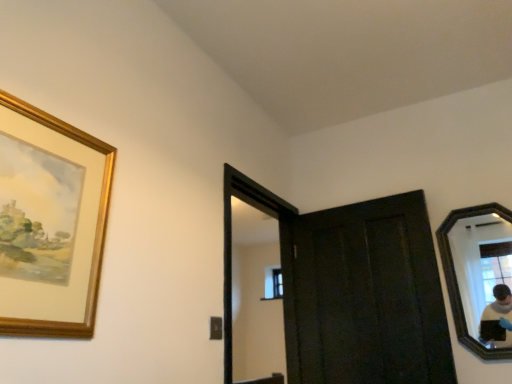
In order to face gold-framed painting at upper left, should I rotate leftwards or rightwards?

Turn left by 25.810 degrees to look at gold-framed painting at upper left.

You are a GUI agent. You are given a task and a screenshot of the screen. Output one action in this format:
    pyautogui.click(x=<x>, y=<y>)
    Task: Click on the dark wood door at center
    
    Given the screenshot: What is the action you would take?
    pyautogui.click(x=364, y=295)

Is clear glass window at center wider than dark wood door at center?

No.

Considering the relative positions of clear glass window at center and dark wood door at center in the image provided, is clear glass window at center to the right of dark wood door at center from the viewer's perspective?

No, clear glass window at center is not to the right of dark wood door at center.

Is clear glass window at center not inside dark wood door at center?

Yes, clear glass window at center is located beyond the bounds of dark wood door at center.

Is clear glass window at center bigger or smaller than dark wood door at center?

Considering their sizes, clear glass window at center takes up less space than dark wood door at center.

Would you consider gold-framed painting at upper left to be distant from dark wood door at center?

Yes, gold-framed painting at upper left is far from dark wood door at center.

Is gold-framed painting at upper left oriented away from dark wood door at center?

No, gold-framed painting at upper left is not facing away from dark wood door at center.

Can you confirm if gold-framed painting at upper left is positioned to the left of dark wood door at center?

Yes.

Consider the image. From a real-world perspective, is gold-framed painting at upper left physically below dark wood door at center?

No, from a real-world perspective, gold-framed painting at upper left is not below dark wood door at center.

Is black wooden mirror at right turned away from clear glass window at center?

No.

Can you confirm if black wooden mirror at right is positioned to the left of clear glass window at center?

In fact, black wooden mirror at right is to the right of clear glass window at center.

Is black wooden mirror at right completely or partially outside of clear glass window at center?

Yes, black wooden mirror at right is located beyond the bounds of clear glass window at center.

Is point (300, 225) positioned after point (486, 293)?

Yes, it is.

Are dark wood door at center and black wooden mirror at right located far from each other?

No, dark wood door at center is not far away from black wooden mirror at right.

Where is `door below the black wooden mirror at right (from the image's perspective)`? door below the black wooden mirror at right (from the image's perspective) is located at coordinates [x=364, y=295].

From a real-world perspective, is gold-framed painting at upper left positioned above or below black wooden mirror at right?

gold-framed painting at upper left is situated higher than black wooden mirror at right in the real world.

Considering the positions of objects gold-framed painting at upper left and black wooden mirror at right in the image provided, who is behind, gold-framed painting at upper left or black wooden mirror at right?

black wooden mirror at right is more distant.

Which is further, (91, 295) or (509, 314)?

Point (509, 314)

Is clear glass window at center positioned behind black wooden mirror at right?

Yes, clear glass window at center is further from the viewer.

Considering the relative sizes of clear glass window at center and black wooden mirror at right in the image provided, is clear glass window at center taller than black wooden mirror at right?

No, clear glass window at center is not taller than black wooden mirror at right.

Who is smaller, clear glass window at center or black wooden mirror at right?

clear glass window at center.

Is clear glass window at center next to gold-framed painting at upper left and touching it?

No, clear glass window at center is not making contact with gold-framed painting at upper left.

Where is `picture frame below the clear glass window at center (from a real-world perspective)`? The height and width of the screenshot is (384, 512). picture frame below the clear glass window at center (from a real-world perspective) is located at coordinates (50, 222).

Can you confirm if clear glass window at center is smaller than gold-framed painting at upper left?

Indeed, clear glass window at center has a smaller size compared to gold-framed painting at upper left.

Is clear glass window at center wider or thinner than gold-framed painting at upper left?

Considering their sizes, clear glass window at center looks broader than gold-framed painting at upper left.

At what (x,y) coordinates should I click in order to perform the action: click on window on the left side of dark wood door at center. Please return your answer as a coordinate pair (x, y). Looking at the image, I should click on (273, 283).

Where is `picture frame that appears above the dark wood door at center (from a real-world perspective)`? The width and height of the screenshot is (512, 384). picture frame that appears above the dark wood door at center (from a real-world perspective) is located at coordinates (50, 222).

Based on their spatial positions, is gold-framed painting at upper left or black wooden mirror at right further from clear glass window at center?

gold-framed painting at upper left.

Considering their positions, is clear glass window at center positioned closer to black wooden mirror at right than gold-framed painting at upper left?

Among the two, gold-framed painting at upper left is located nearer to black wooden mirror at right.

From the image, which object appears to be nearer to gold-framed painting at upper left, black wooden mirror at right or dark wood door at center?

The object closer to gold-framed painting at upper left is dark wood door at center.

When comparing their distances from dark wood door at center, does gold-framed painting at upper left or black wooden mirror at right seem further?

gold-framed painting at upper left is positioned further to the anchor dark wood door at center.

Estimate the real-world distances between objects in this image. Which object is closer to gold-framed painting at upper left, dark wood door at center or clear glass window at center?

dark wood door at center is positioned closer to the anchor gold-framed painting at upper left.

Consider the image. Estimate the real-world distances between objects in this image. Which object is closer to dark wood door at center, clear glass window at center or black wooden mirror at right?

black wooden mirror at right lies closer to dark wood door at center than the other object.

From the image, which object appears to be nearer to gold-framed painting at upper left, clear glass window at center or black wooden mirror at right?

The object closer to gold-framed painting at upper left is black wooden mirror at right.

Considering their positions, is black wooden mirror at right positioned closer to clear glass window at center than gold-framed painting at upper left?

Based on the image, black wooden mirror at right appears to be nearer to clear glass window at center.

The width and height of the screenshot is (512, 384). I want to click on mirror positioned between dark wood door at center and clear glass window at center from near to far, so click(481, 266).

Locate an element on the screen. This screenshot has height=384, width=512. door located between gold-framed painting at upper left and clear glass window at center in the depth direction is located at coordinates (364, 295).

I want to click on mirror between gold-framed painting at upper left and clear glass window at center along the z-axis, so click(481, 266).

I want to click on door between gold-framed painting at upper left and black wooden mirror at right in the horizontal direction, so click(x=364, y=295).